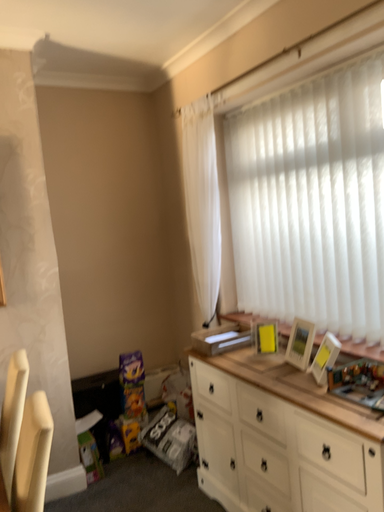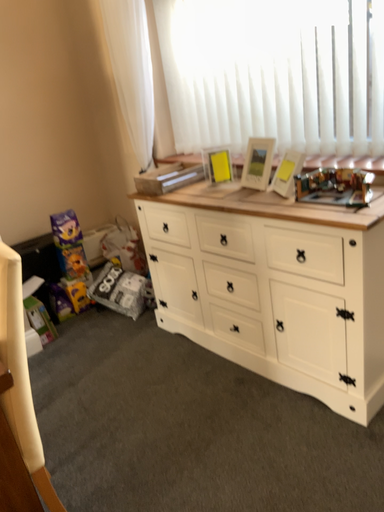
Question: Which way did the camera rotate in the video?

Choices:
 (A) rotated downward
 (B) rotated upward

Answer: (A)